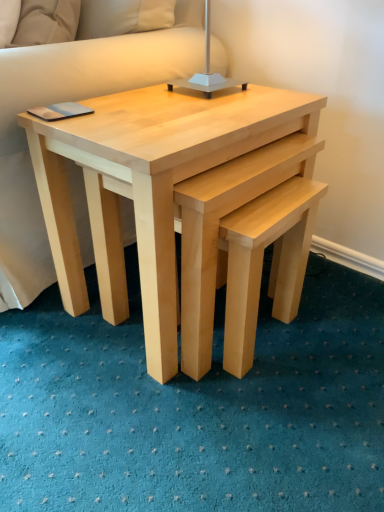
Question: From the image's perspective, relative to natural wood nesting tables at center, is metallic silver table lamp at upper center above or below?

Choices:
 (A) above
 (B) below

Answer: (A)

Question: In terms of size, does metallic silver table lamp at upper center appear bigger or smaller than natural wood nesting tables at center?

Choices:
 (A) big
 (B) small

Answer: (B)

Question: Is metallic silver table lamp at upper center in front of or behind natural wood nesting tables at center in the image?

Choices:
 (A) front
 (B) behind

Answer: (B)

Question: Is natural wood nesting tables at center to the left or to the right of metallic silver table lamp at upper center in the image?

Choices:
 (A) left
 (B) right

Answer: (A)

Question: From the image's perspective, is natural wood nesting tables at center above or below metallic silver table lamp at upper center?

Choices:
 (A) below
 (B) above

Answer: (A)

Question: Is natural wood nesting tables at center inside the boundaries of metallic silver table lamp at upper center, or outside?

Choices:
 (A) outside
 (B) inside

Answer: (A)

Question: From a real-world perspective, is natural wood nesting tables at center above or below metallic silver table lamp at upper center?

Choices:
 (A) below
 (B) above

Answer: (A)